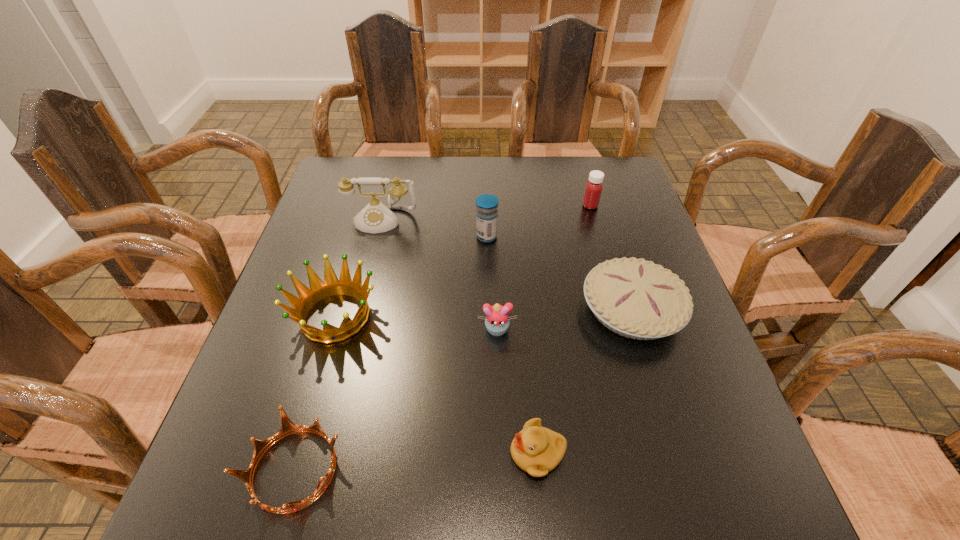
I want to click on crown situated at the near edge, so click(288, 427).

Where is `telephone that is at the left edge`? telephone that is at the left edge is located at coordinates (376, 217).

This screenshot has width=960, height=540. I want to click on medicine that is positioned at the right edge, so click(593, 190).

I want to click on pie at the right edge, so click(635, 298).

Where is `object that is at the near left corner`? object that is at the near left corner is located at coordinates (288, 427).

The image size is (960, 540). Find the location of `object that is at the far right corner`. object that is at the far right corner is located at coordinates (593, 190).

You are a GUI agent. You are given a task and a screenshot of the screen. Output one action in this format:
    pyautogui.click(x=<x>, y=<y>)
    Task: Click on the free space at the far edge of the desktop
    
    Given the screenshot: What is the action you would take?
    pyautogui.click(x=534, y=198)

The image size is (960, 540). In order to click on vacant area at the near edge in this screenshot , I will do `click(499, 500)`.

In order to click on vacant space at the left edge of the desktop in this screenshot , I will do `click(312, 385)`.

You are a GUI agent. You are given a task and a screenshot of the screen. Output one action in this format:
    pyautogui.click(x=<x>, y=<y>)
    Task: Click on the vacant space at the right edge of the desktop
    The width and height of the screenshot is (960, 540).
    Given the screenshot: What is the action you would take?
    pyautogui.click(x=698, y=366)